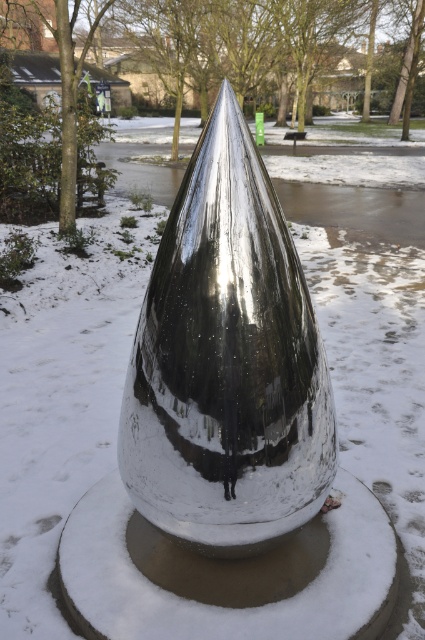
Question: Is shiny metallic cone at center positioned before brown wood tree at left?

Choices:
 (A) yes
 (B) no

Answer: (A)

Question: Among these points, which one is farthest from the camera?

Choices:
 (A) (68, 52)
 (B) (181, 492)

Answer: (A)

Question: Can you confirm if green matte tree at center is positioned to the left of brown wood tree at left?

Choices:
 (A) yes
 (B) no

Answer: (B)

Question: Which object is closer to the camera taking this photo?

Choices:
 (A) brown wood tree at left
 (B) shiny metallic cone at center
 (C) green matte tree at center

Answer: (B)

Question: Which point is farther from the camera taking this photo?

Choices:
 (A) (54, 204)
 (B) (268, 227)

Answer: (A)

Question: Does green matte tree at center come behind brown wood tree at left?

Choices:
 (A) no
 (B) yes

Answer: (A)